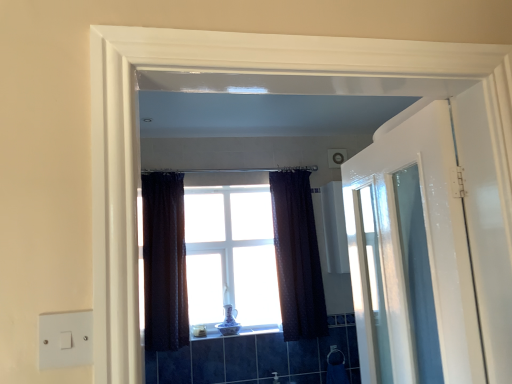
Question: Can you confirm if dark textured curtain at center, acting as the first curtain starting from the left, is positioned to the right of satin nickel faucet at lower center?

Choices:
 (A) no
 (B) yes

Answer: (A)

Question: Considering the relative sizes of dark textured curtain at center, placed as the 2th curtain when sorted from right to left, and satin nickel faucet at lower center in the image provided, is dark textured curtain at center, placed as the 2th curtain when sorted from right to left, wider than satin nickel faucet at lower center?

Choices:
 (A) yes
 (B) no

Answer: (A)

Question: Does dark textured curtain at center, placed as the 2th curtain when sorted from right to left, come behind satin nickel faucet at lower center?

Choices:
 (A) no
 (B) yes

Answer: (A)

Question: Does dark textured curtain at center, acting as the first curtain starting from the left, have a smaller size compared to satin nickel faucet at lower center?

Choices:
 (A) no
 (B) yes

Answer: (A)

Question: Does dark textured curtain at center, placed as the 2th curtain when sorted from right to left, have a lesser height compared to satin nickel faucet at lower center?

Choices:
 (A) yes
 (B) no

Answer: (B)

Question: Considering the relative positions of dark textured curtain at center, acting as the first curtain starting from the left, and white glossy door at right in the image provided, is dark textured curtain at center, acting as the first curtain starting from the left, to the left or to the right of white glossy door at right?

Choices:
 (A) right
 (B) left

Answer: (B)

Question: Relative to white glossy door at right, is dark textured curtain at center, acting as the first curtain starting from the left, in front or behind?

Choices:
 (A) behind
 (B) front

Answer: (A)

Question: From the image's perspective, relative to white glossy door at right, is dark textured curtain at center, placed as the 2th curtain when sorted from right to left, above or below?

Choices:
 (A) below
 (B) above

Answer: (A)

Question: Is dark textured curtain at center, acting as the first curtain starting from the left, situated inside white glossy door at right or outside?

Choices:
 (A) inside
 (B) outside

Answer: (B)

Question: Based on their positions, is satin nickel faucet at lower center located to the left or right of dark textured curtain at center, the second curtain when ordered from left to right?

Choices:
 (A) left
 (B) right

Answer: (A)

Question: Is satin nickel faucet at lower center situated inside dark textured curtain at center, which is the 1th curtain in right-to-left order, or outside?

Choices:
 (A) outside
 (B) inside

Answer: (A)

Question: Is point (274, 377) closer or farther from the camera than point (318, 309)?

Choices:
 (A) farther
 (B) closer

Answer: (B)

Question: Is satin nickel faucet at lower center bigger or smaller than dark textured curtain at center, which is the 1th curtain in right-to-left order?

Choices:
 (A) small
 (B) big

Answer: (A)

Question: Is satin nickel faucet at lower center inside or outside of dark textured curtain at center, acting as the first curtain starting from the left?

Choices:
 (A) inside
 (B) outside

Answer: (B)

Question: From a real-world perspective, is satin nickel faucet at lower center positioned above or below dark textured curtain at center, placed as the 2th curtain when sorted from right to left?

Choices:
 (A) below
 (B) above

Answer: (A)